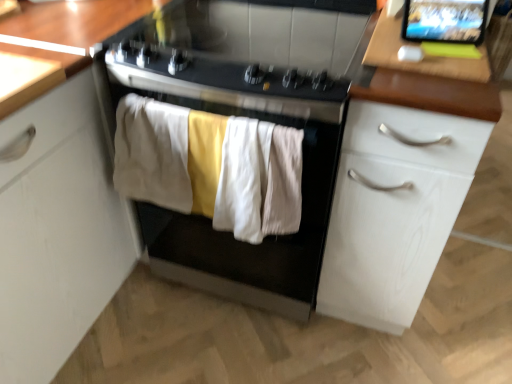
Question: From the image's perspective, does matte black tablet at upper right appear higher than black glass gas stove at center?

Choices:
 (A) no
 (B) yes

Answer: (A)

Question: Is matte black tablet at upper right not within black glass gas stove at center?

Choices:
 (A) yes
 (B) no

Answer: (A)

Question: Is matte black tablet at upper right positioned before black glass gas stove at center?

Choices:
 (A) no
 (B) yes

Answer: (A)

Question: Is matte black tablet at upper right at the right side of black glass gas stove at center?

Choices:
 (A) yes
 (B) no

Answer: (A)

Question: Is matte black tablet at upper right smaller than black glass gas stove at center?

Choices:
 (A) no
 (B) yes

Answer: (B)

Question: Is point (455, 16) closer or farther from the camera than point (361, 299)?

Choices:
 (A) closer
 (B) farther

Answer: (A)

Question: Is matte black tablet at upper right situated inside white wood cabinet at right or outside?

Choices:
 (A) outside
 (B) inside

Answer: (A)

Question: Would you say matte black tablet at upper right is to the left or to the right of white wood cabinet at right in the picture?

Choices:
 (A) left
 (B) right

Answer: (B)

Question: From a real-world perspective, is matte black tablet at upper right above or below white wood cabinet at right?

Choices:
 (A) above
 (B) below

Answer: (A)

Question: Is point (373, 213) positioned closer to the camera than point (243, 231)?

Choices:
 (A) farther
 (B) closer

Answer: (A)

Question: In terms of size, does white wood cabinet at right appear bigger or smaller than soft cotton towels at center, which is the second clothing in right-to-left order?

Choices:
 (A) big
 (B) small

Answer: (A)

Question: From their relative heights in the image, would you say white wood cabinet at right is taller or shorter than soft cotton towels at center, the 2th clothing from the left?

Choices:
 (A) tall
 (B) short

Answer: (A)

Question: In the image, is white wood cabinet at right positioned in front of or behind soft cotton towels at center, which is the second clothing in right-to-left order?

Choices:
 (A) front
 (B) behind

Answer: (A)

Question: Considering the positions of wooden table at upper right and soft cotton towels at center, which is the second clothing in right-to-left order, in the image, is wooden table at upper right bigger or smaller than soft cotton towels at center, which is the second clothing in right-to-left order,?

Choices:
 (A) big
 (B) small

Answer: (B)

Question: In terms of width, does wooden table at upper right look wider or thinner when compared to soft cotton towels at center, which is the second clothing in right-to-left order?

Choices:
 (A) wide
 (B) thin

Answer: (A)